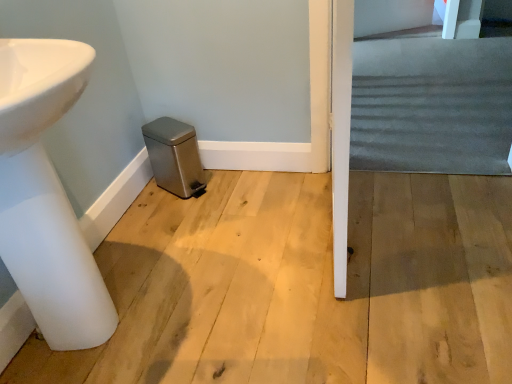
Find the location of `white glossy sink at lower left`. white glossy sink at lower left is located at coordinates (46, 196).

Image resolution: width=512 pixels, height=384 pixels. What do you see at coordinates (46, 196) in the screenshot? I see `white glossy sink at lower left` at bounding box center [46, 196].

Describe the element at coordinates (431, 105) in the screenshot. I see `dark gray carpet at right` at that location.

Find the location of a particular element. The image size is (512, 384). dark gray carpet at right is located at coordinates (431, 105).

Identify the location of white glossy sink at lower left. (46, 196).

Which is more to the left, white glossy sink at lower left or dark gray carpet at right?

white glossy sink at lower left.

Considering the positions of objects white glossy sink at lower left and dark gray carpet at right in the image provided, who is in front, white glossy sink at lower left or dark gray carpet at right?

white glossy sink at lower left.

Is point (79, 75) behind point (457, 159)?

No.

From the image's perspective, is white glossy sink at lower left above or below dark gray carpet at right?

white glossy sink at lower left is below dark gray carpet at right.

From a real-world perspective, is white glossy sink at lower left physically located above or below dark gray carpet at right?

white glossy sink at lower left is above dark gray carpet at right.

Between white glossy sink at lower left and dark gray carpet at right, which one has larger width?

dark gray carpet at right.

Considering the sizes of objects white glossy sink at lower left and dark gray carpet at right in the image provided, who is shorter, white glossy sink at lower left or dark gray carpet at right?

dark gray carpet at right.

Between white glossy sink at lower left and dark gray carpet at right, which one has smaller size?

With smaller size is white glossy sink at lower left.

Would you say white glossy sink at lower left contains dark gray carpet at right?

No, dark gray carpet at right is located outside of white glossy sink at lower left.

Is white glossy sink at lower left far from dark gray carpet at right?

Indeed, white glossy sink at lower left is not near dark gray carpet at right.

Is white glossy sink at lower left looking in the opposite direction of dark gray carpet at right?

No, white glossy sink at lower left is not facing the opposite direction of dark gray carpet at right.

Measure the distance from white glossy sink at lower left to dark gray carpet at right.

white glossy sink at lower left and dark gray carpet at right are 1.75 meters apart.

Find the location of `stairwell above the white glossy sink at lower left (from the image's perspective)`. stairwell above the white glossy sink at lower left (from the image's perspective) is located at coordinates (431, 105).

Which is more to the right, dark gray carpet at right or white glossy sink at lower left?

dark gray carpet at right is more to the right.

Considering their positions, is dark gray carpet at right located in front of or behind white glossy sink at lower left?

Clearly, dark gray carpet at right is behind white glossy sink at lower left.

Is point (443, 145) more distant than point (8, 57)?

Yes.

From the image's perspective, is dark gray carpet at right above or below white glossy sink at lower left?

dark gray carpet at right is above white glossy sink at lower left.

From a real-world perspective, relative to white glossy sink at lower left, is dark gray carpet at right vertically above or below?

From a real-world perspective, dark gray carpet at right is physically below white glossy sink at lower left.

Looking at this image, between dark gray carpet at right and white glossy sink at lower left, which one has smaller width?

With smaller width is white glossy sink at lower left.

Is dark gray carpet at right taller than white glossy sink at lower left?

No, dark gray carpet at right is not taller than white glossy sink at lower left.

Is dark gray carpet at right bigger or smaller than white glossy sink at lower left?

dark gray carpet at right is bigger than white glossy sink at lower left.

Does dark gray carpet at right contain white glossy sink at lower left?

Definitely not — white glossy sink at lower left is not inside dark gray carpet at right.

Is dark gray carpet at right with white glossy sink at lower left?

No, dark gray carpet at right is not with white glossy sink at lower left.

Could you tell me if dark gray carpet at right is facing white glossy sink at lower left?

No, dark gray carpet at right does not turn towards white glossy sink at lower left.

In the image, there is a dark gray carpet at right. Where is `sink below it (from the image's perspective)`? The height and width of the screenshot is (384, 512). sink below it (from the image's perspective) is located at coordinates (46, 196).

Find the location of `sink that is in front of the dark gray carpet at right`. sink that is in front of the dark gray carpet at right is located at coordinates (46, 196).

You are a GUI agent. You are given a task and a screenshot of the screen. Output one action in this format:
    pyautogui.click(x=<x>, y=<y>)
    Task: Click on the stairwell behind the white glossy sink at lower left
    
    Given the screenshot: What is the action you would take?
    pyautogui.click(x=431, y=105)